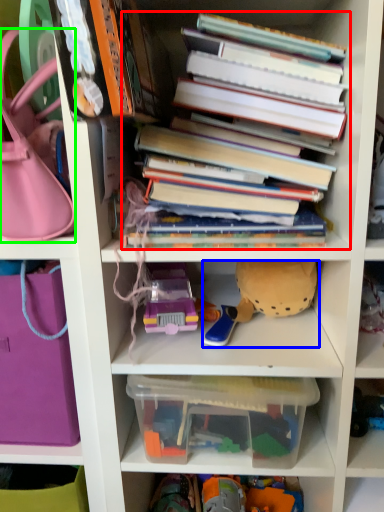
Question: Considering the real-world distances, which object is closest to book (highlighted by a red box)? toy (highlighted by a blue box) or handbag (highlighted by a green box).

Choices:
 (A) toy
 (B) handbag

Answer: (A)